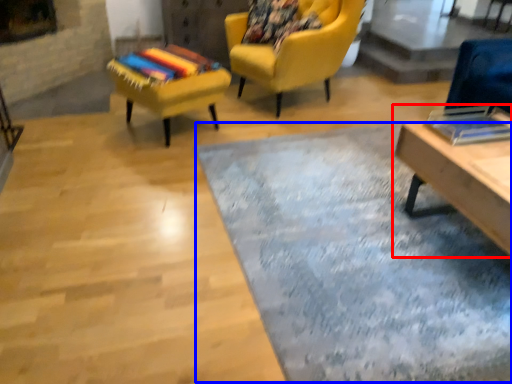
Question: Among these objects, which one is nearest to the camera, table (highlighted by a red box) or mat (highlighted by a blue box)?

Choices:
 (A) table
 (B) mat

Answer: (B)